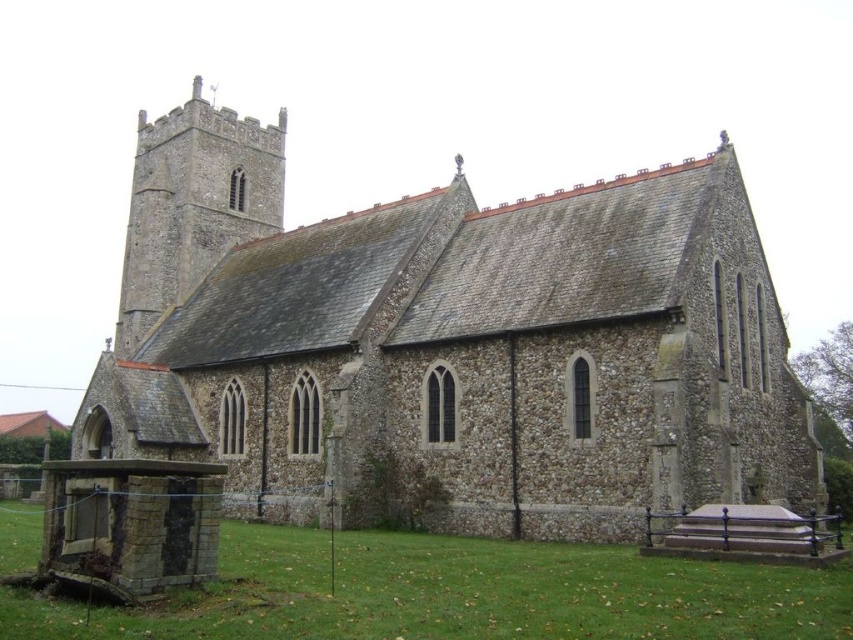
Question: Which point is closer to the camera?

Choices:
 (A) 143,166
 (B) 321,634

Answer: (B)

Question: Which object is farther from the camera taking this photo?

Choices:
 (A) green grass at lower left
 (B) gray stone tower at upper left

Answer: (B)

Question: Is green grass at lower left below gray stone tower at upper left?

Choices:
 (A) yes
 (B) no

Answer: (A)

Question: Can you confirm if green grass at lower left is wider than gray stone tower at upper left?

Choices:
 (A) no
 (B) yes

Answer: (B)

Question: Which point is farther to the camera?

Choices:
 (A) (166, 131)
 (B) (55, 636)

Answer: (A)

Question: Does green grass at lower left come in front of gray stone tower at upper left?

Choices:
 (A) no
 (B) yes

Answer: (B)